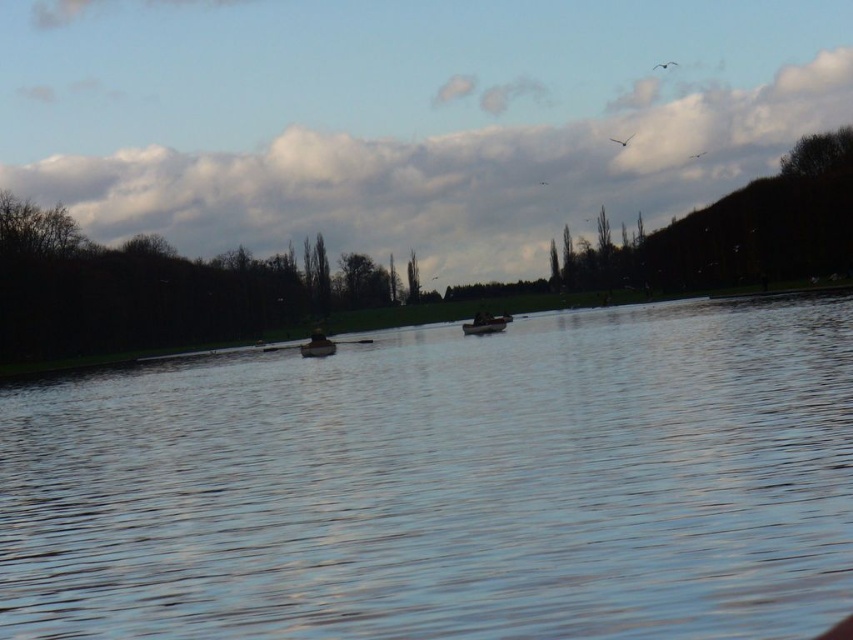
Does smooth water at center appear over dark brown wooden boat at center?

Actually, smooth water at center is below dark brown wooden boat at center.

The height and width of the screenshot is (640, 853). Find the location of `smooth water at center`. smooth water at center is located at coordinates [x=447, y=484].

Locate an element on the screen. This screenshot has width=853, height=640. smooth water at center is located at coordinates (447, 484).

This screenshot has width=853, height=640. Find the location of `smooth water at center`. smooth water at center is located at coordinates (447, 484).

Can you confirm if wooden boat at center is positioned above dark brown wooden boat at center?

Correct, wooden boat at center is located above dark brown wooden boat at center.

At what (x,y) coordinates should I click in order to perform the action: click on wooden boat at center. Please return your answer as a coordinate pair (x, y). Looking at the image, I should click on (485, 324).

Is point (473, 323) positioned after point (328, 348)?

Yes, point (473, 323) is behind point (328, 348).

I want to click on wooden boat at center, so click(485, 324).

Is smooth water at center bigger than wooden boat at center?

Indeed, smooth water at center has a larger size compared to wooden boat at center.

Does smooth water at center appear on the right side of wooden boat at center?

Incorrect, smooth water at center is not on the right side of wooden boat at center.

Which is in front, point (434, 632) or point (467, 333)?

Point (434, 632) is more forward.

The width and height of the screenshot is (853, 640). Find the location of `smooth water at center`. smooth water at center is located at coordinates (447, 484).